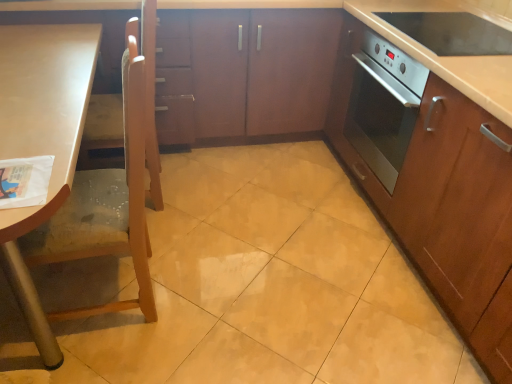
Identify the location of vacant region to the right of light brown wood chair at left. The height and width of the screenshot is (384, 512). tap(212, 314).